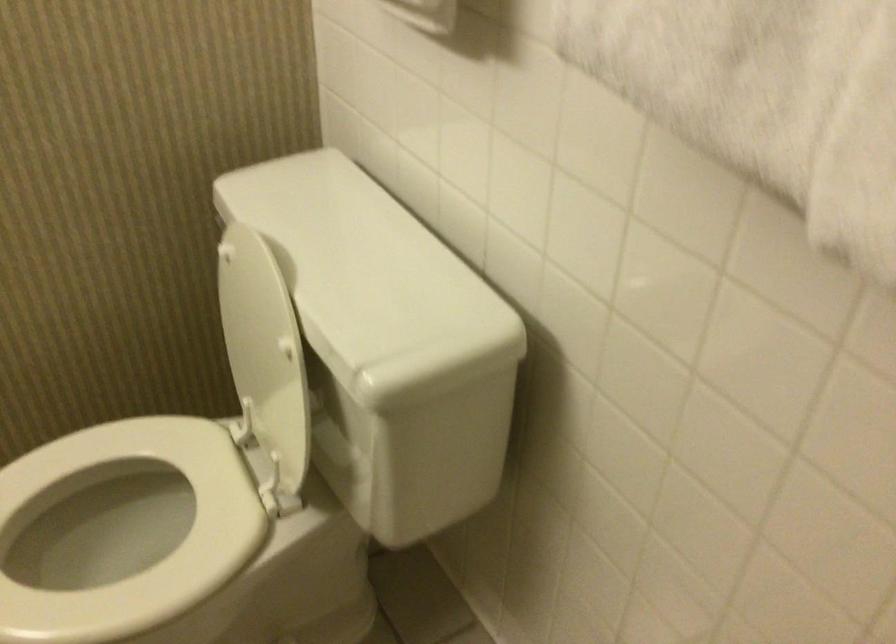
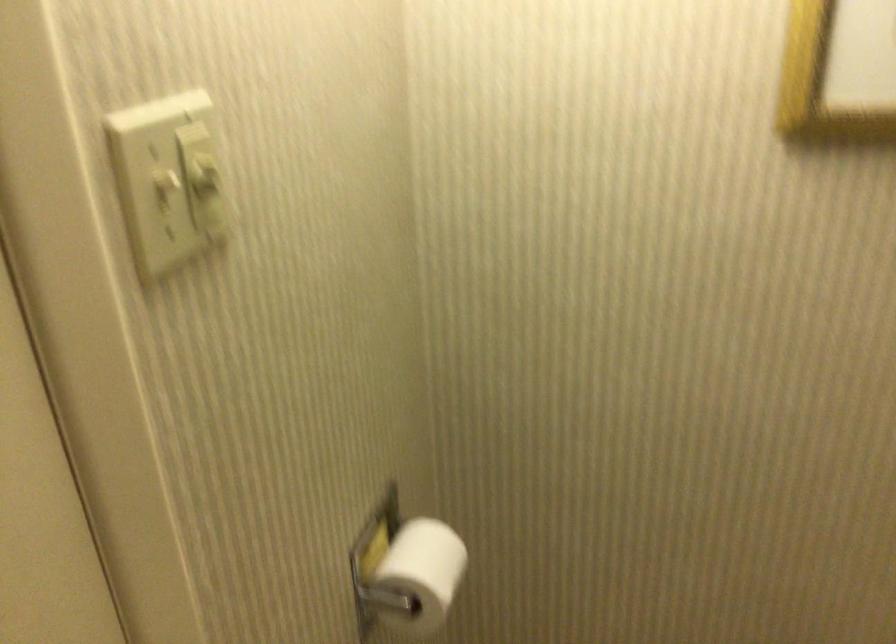
Question: The camera is either moving clockwise (left) or counter-clockwise (right) around the object. The first image is from the beginning of the video and the second image is from the end. Is the camera moving left or right when shooting the video?

Choices:
 (A) Left
 (B) Right

Answer: (B)